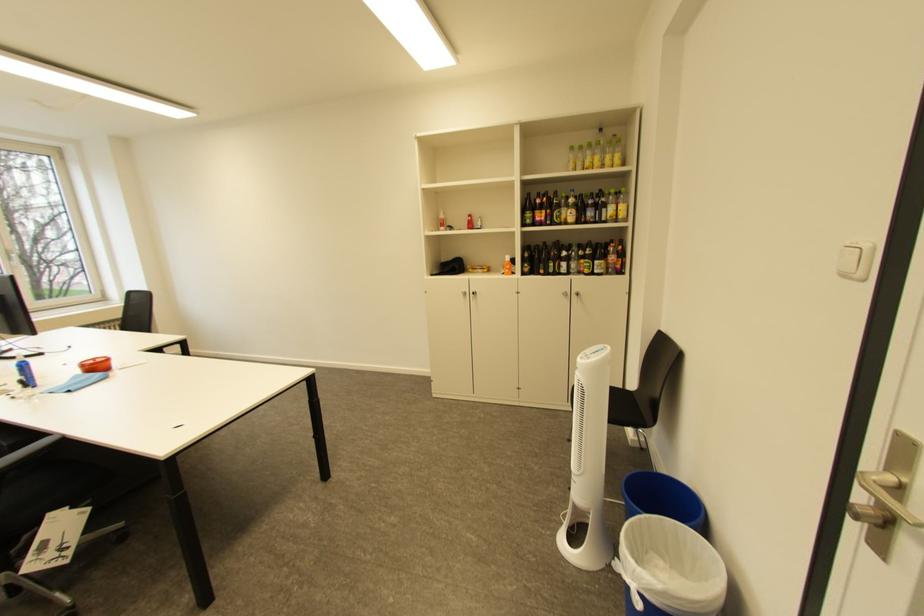
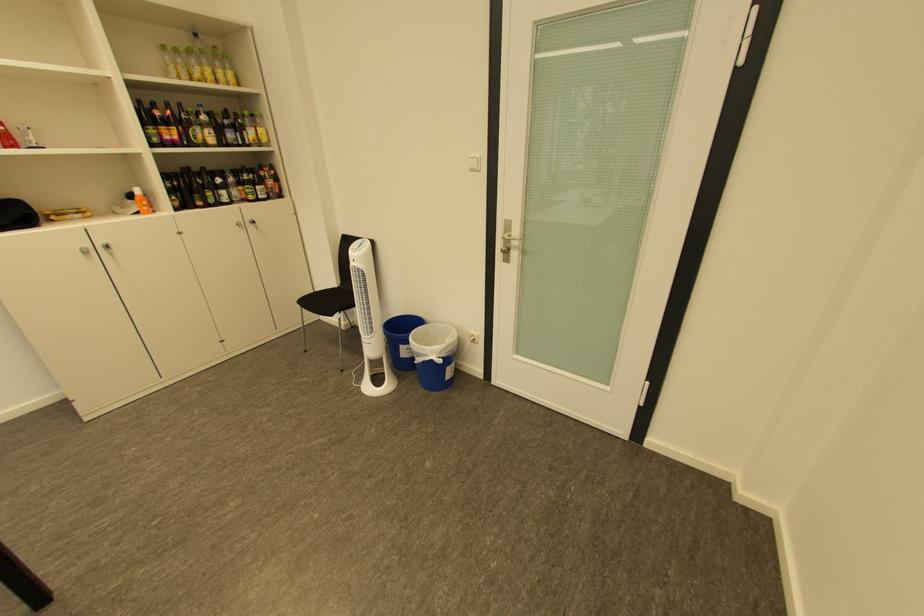
The point at (x=591, y=359) is marked in the first image. Where is the corresponding point in the second image?

(363, 253)